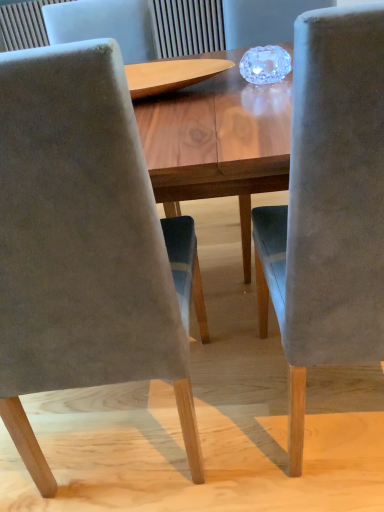
The width and height of the screenshot is (384, 512). Find the location of `vacant region under velvet gray chair at center, which ranks as the second chair in right-to-left order (from a real-world perspective)`. vacant region under velvet gray chair at center, which ranks as the second chair in right-to-left order (from a real-world perspective) is located at coordinates click(121, 436).